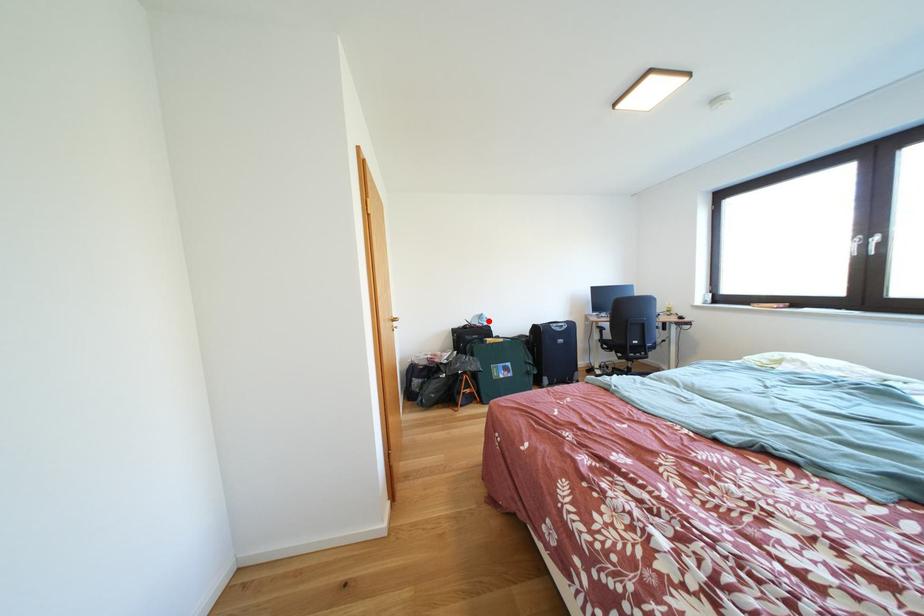
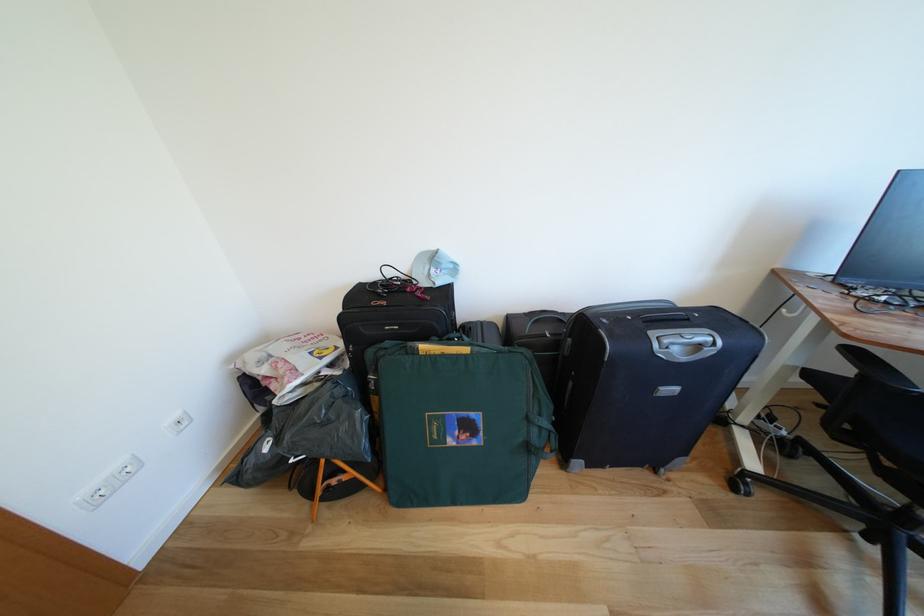
Find the pixel in the second image that matches the highlighted location in the first image.

(442, 262)